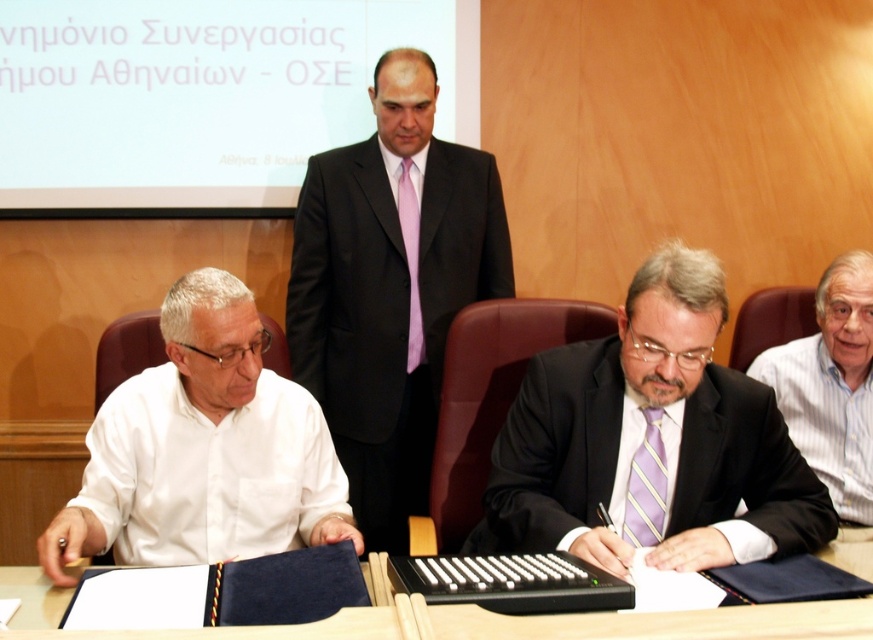
Question: Which of the following is the farthest from the observer?

Choices:
 (A) (56, 637)
 (B) (401, 93)
 (C) (410, 268)
 (D) (495, 531)

Answer: (C)

Question: Among these points, which one is farthest from the camera?

Choices:
 (A) (162, 426)
 (B) (835, 323)

Answer: (B)

Question: Considering the relative positions of white shirt at left and dark blue leather table at lower center in the image provided, where is white shirt at left located with respect to dark blue leather table at lower center?

Choices:
 (A) below
 (B) above

Answer: (B)

Question: Where is purple striped tie at center located in relation to black suit at center in the image?

Choices:
 (A) above
 (B) below

Answer: (B)

Question: Is black suit at center below lavender striped tie at center?

Choices:
 (A) yes
 (B) no

Answer: (B)

Question: Which of the following is the farthest from the observer?

Choices:
 (A) (677, 531)
 (B) (397, 212)
 (C) (631, 499)

Answer: (B)